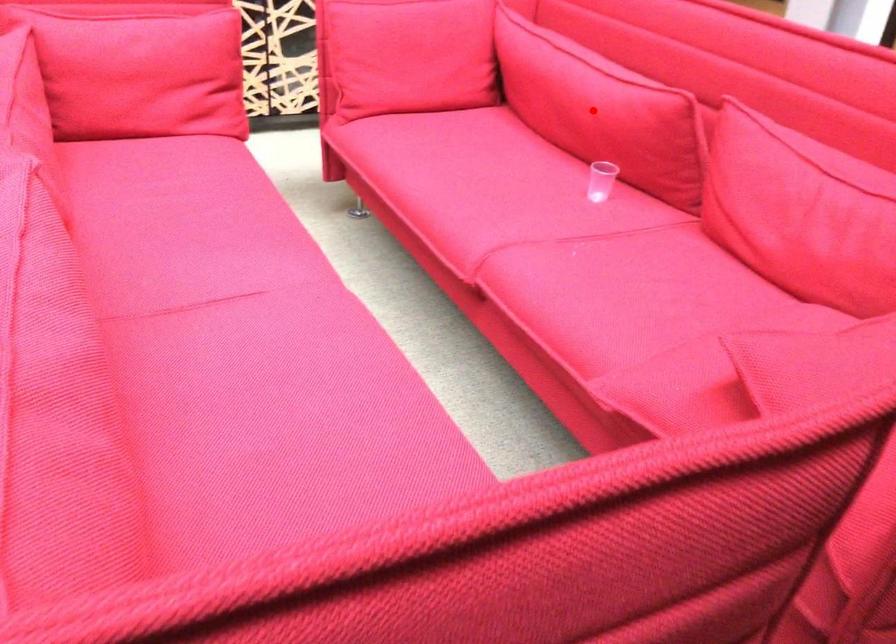
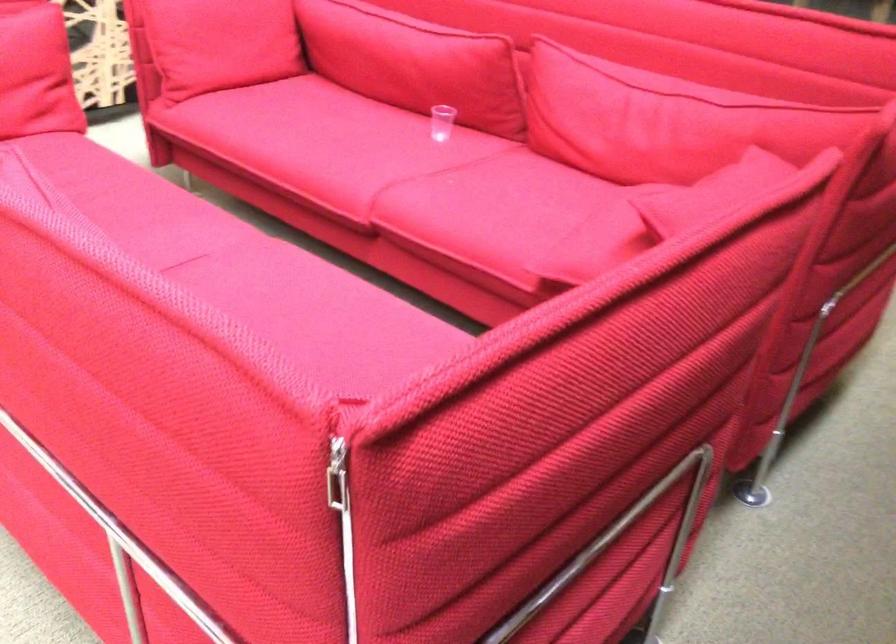
Question: A red point is marked in image1. In image2, is the corresponding 3D point closer to the camera or farther? Reply with the corresponding letter.

Choices:
 (A) The corresponding 3D point is closer.
 (B) The corresponding 3D point is farther.

Answer: (B)